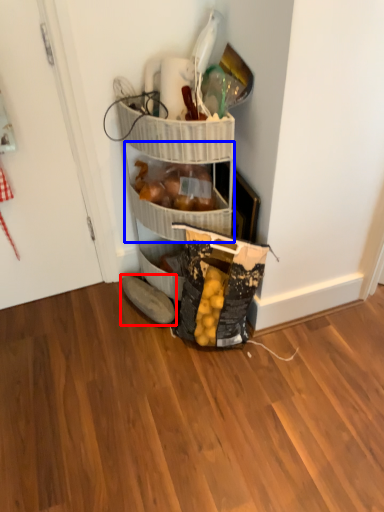
Question: Among these objects, which one is farthest to the camera, footwear (highlighted by a red box) or basket (highlighted by a blue box)?

Choices:
 (A) footwear
 (B) basket

Answer: (A)